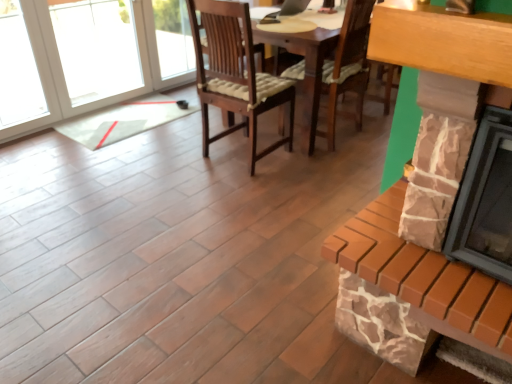
Locate an element on the screen. The width and height of the screenshot is (512, 384). stone fireplace at right, the 1th fireplace from the top is located at coordinates (486, 200).

The image size is (512, 384). What do you see at coordinates (486, 200) in the screenshot?
I see `stone fireplace at right, the 1th fireplace from the top` at bounding box center [486, 200].

This screenshot has height=384, width=512. What do you see at coordinates (416, 272) in the screenshot?
I see `brick fireplace at right, the second fireplace viewed from the top` at bounding box center [416, 272].

The width and height of the screenshot is (512, 384). I want to click on brick fireplace at right, which is counted as the 1th fireplace, starting from the bottom, so click(416, 272).

Measure the distance between brick fireplace at right, the second fireplace viewed from the top, and camera.

brick fireplace at right, the second fireplace viewed from the top, is 1.14 meters from camera.

Where is `stone fireplace at right, the second fireplace when ordered from bottom to top`? stone fireplace at right, the second fireplace when ordered from bottom to top is located at coordinates (486, 200).

Does brick fireplace at right, the second fireplace viewed from the top, appear on the right side of stone fireplace at right, the second fireplace when ordered from bottom to top?

Incorrect, brick fireplace at right, the second fireplace viewed from the top, is not on the right side of stone fireplace at right, the second fireplace when ordered from bottom to top.

Between brick fireplace at right, the second fireplace viewed from the top, and stone fireplace at right, the second fireplace when ordered from bottom to top, which one is positioned in front?

stone fireplace at right, the second fireplace when ordered from bottom to top.

Which is in front, point (391, 57) or point (477, 258)?

The point (391, 57) is more forward.

From the image's perspective, is brick fireplace at right, which is counted as the 1th fireplace, starting from the bottom, over stone fireplace at right, the 1th fireplace from the top?

No, from the image's perspective, brick fireplace at right, which is counted as the 1th fireplace, starting from the bottom, is not above stone fireplace at right, the 1th fireplace from the top.

Looking at this image, from a real-world perspective, who is located higher, brick fireplace at right, the second fireplace viewed from the top, or stone fireplace at right, the second fireplace when ordered from bottom to top?

From a 3D spatial view, stone fireplace at right, the second fireplace when ordered from bottom to top, is above.

Looking at this image, considering the relative sizes of brick fireplace at right, which is counted as the 1th fireplace, starting from the bottom, and stone fireplace at right, the second fireplace when ordered from bottom to top, in the image provided, is brick fireplace at right, which is counted as the 1th fireplace, starting from the bottom, wider than stone fireplace at right, the second fireplace when ordered from bottom to top,?

Yes.

Can you confirm if brick fireplace at right, the second fireplace viewed from the top, is shorter than stone fireplace at right, the 1th fireplace from the top?

Yes, brick fireplace at right, the second fireplace viewed from the top, is shorter than stone fireplace at right, the 1th fireplace from the top.

Considering the relative sizes of brick fireplace at right, the second fireplace viewed from the top, and stone fireplace at right, the second fireplace when ordered from bottom to top, in the image provided, is brick fireplace at right, the second fireplace viewed from the top, bigger than stone fireplace at right, the second fireplace when ordered from bottom to top,?

Incorrect, brick fireplace at right, the second fireplace viewed from the top, is not larger than stone fireplace at right, the second fireplace when ordered from bottom to top.

Is stone fireplace at right, the second fireplace when ordered from bottom to top, inside brick fireplace at right, the second fireplace viewed from the top?

No, brick fireplace at right, the second fireplace viewed from the top, does not contain stone fireplace at right, the second fireplace when ordered from bottom to top.

Is brick fireplace at right, the second fireplace viewed from the top, beside stone fireplace at right, the second fireplace when ordered from bottom to top?

No, brick fireplace at right, the second fireplace viewed from the top, is not in contact with stone fireplace at right, the second fireplace when ordered from bottom to top.

In the scene shown: Is brick fireplace at right, which is counted as the 1th fireplace, starting from the bottom, turned away from stone fireplace at right, the second fireplace when ordered from bottom to top?

No, stone fireplace at right, the second fireplace when ordered from bottom to top, is not at the back of brick fireplace at right, which is counted as the 1th fireplace, starting from the bottom.

How different are the orientations of brick fireplace at right, the second fireplace viewed from the top, and stone fireplace at right, the second fireplace when ordered from bottom to top, in degrees?

0.000713 degrees.

Measure the distance between brick fireplace at right, the second fireplace viewed from the top, and stone fireplace at right, the 1th fireplace from the top.

brick fireplace at right, the second fireplace viewed from the top, and stone fireplace at right, the 1th fireplace from the top, are 22.52 centimeters apart from each other.

This screenshot has height=384, width=512. I want to click on fireplace above the brick fireplace at right, the second fireplace viewed from the top (from the image's perspective), so click(x=486, y=200).

Is stone fireplace at right, the 1th fireplace from the top, to the right of brick fireplace at right, the second fireplace viewed from the top, from the viewer's perspective?

Yes, stone fireplace at right, the 1th fireplace from the top, is to the right of brick fireplace at right, the second fireplace viewed from the top.

Is stone fireplace at right, the 1th fireplace from the top, in front of or behind brick fireplace at right, which is counted as the 1th fireplace, starting from the bottom, in the image?

Clearly, stone fireplace at right, the 1th fireplace from the top, is in front of brick fireplace at right, which is counted as the 1th fireplace, starting from the bottom.

Between point (502, 239) and point (399, 14), which one is positioned behind?

The point (502, 239) is more distant.

From the image's perspective, between stone fireplace at right, the second fireplace when ordered from bottom to top, and brick fireplace at right, the second fireplace viewed from the top, who is located below?

brick fireplace at right, the second fireplace viewed from the top, from the image's perspective.

Consider the image. From a real-world perspective, is stone fireplace at right, the 1th fireplace from the top, located beneath brick fireplace at right, the second fireplace viewed from the top?

No.

Is stone fireplace at right, the second fireplace when ordered from bottom to top, wider or thinner than brick fireplace at right, the second fireplace viewed from the top?

In the image, stone fireplace at right, the second fireplace when ordered from bottom to top, appears to be more narrow than brick fireplace at right, the second fireplace viewed from the top.

Who is shorter, stone fireplace at right, the second fireplace when ordered from bottom to top, or brick fireplace at right, the second fireplace viewed from the top?

brick fireplace at right, the second fireplace viewed from the top, is shorter.

From the picture: Can you confirm if stone fireplace at right, the 1th fireplace from the top, is bigger than brick fireplace at right, the second fireplace viewed from the top?

Indeed, stone fireplace at right, the 1th fireplace from the top, has a larger size compared to brick fireplace at right, the second fireplace viewed from the top.

Is stone fireplace at right, the 1th fireplace from the top, completely or partially outside of brick fireplace at right, which is counted as the 1th fireplace, starting from the bottom?

stone fireplace at right, the 1th fireplace from the top, lies outside brick fireplace at right, which is counted as the 1th fireplace, starting from the bottom,'s area.

Is stone fireplace at right, the second fireplace when ordered from bottom to top, touching brick fireplace at right, which is counted as the 1th fireplace, starting from the bottom?

No, stone fireplace at right, the second fireplace when ordered from bottom to top, is not making contact with brick fireplace at right, which is counted as the 1th fireplace, starting from the bottom.

Does stone fireplace at right, the 1th fireplace from the top, turn towards brick fireplace at right, which is counted as the 1th fireplace, starting from the bottom?

No, stone fireplace at right, the 1th fireplace from the top, is not turned towards brick fireplace at right, which is counted as the 1th fireplace, starting from the bottom.

What's the angular difference between stone fireplace at right, the 1th fireplace from the top, and brick fireplace at right, the second fireplace viewed from the top,'s facing directions?

The facing directions of stone fireplace at right, the 1th fireplace from the top, and brick fireplace at right, the second fireplace viewed from the top, are 0.000713 degrees apart.

The height and width of the screenshot is (384, 512). I want to click on fireplace on the right of brick fireplace at right, the second fireplace viewed from the top, so click(486, 200).

Locate an element on the screen. This screenshot has height=384, width=512. fireplace behind the stone fireplace at right, the second fireplace when ordered from bottom to top is located at coordinates (416, 272).

Locate an element on the screen. The image size is (512, 384). fireplace in front of the brick fireplace at right, which is counted as the 1th fireplace, starting from the bottom is located at coordinates (486, 200).